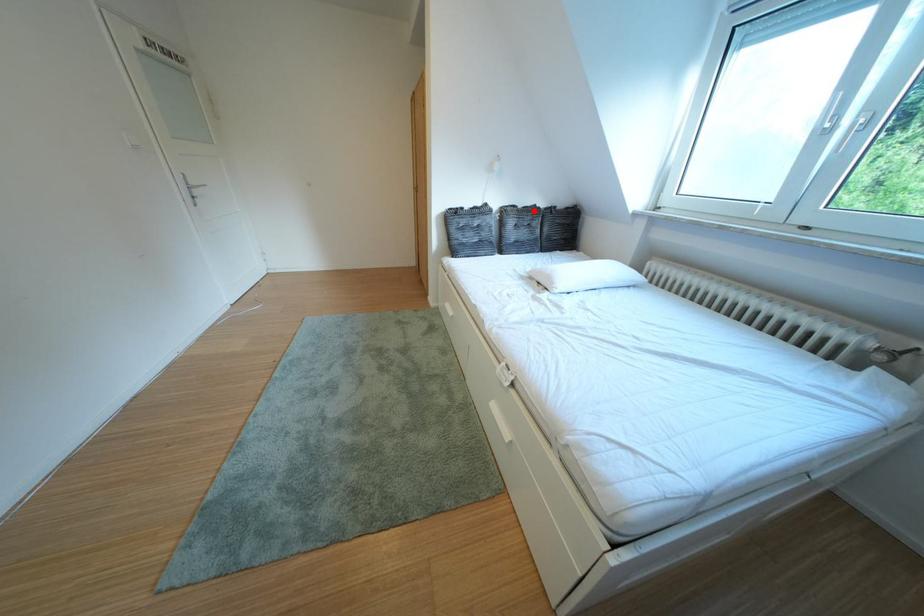
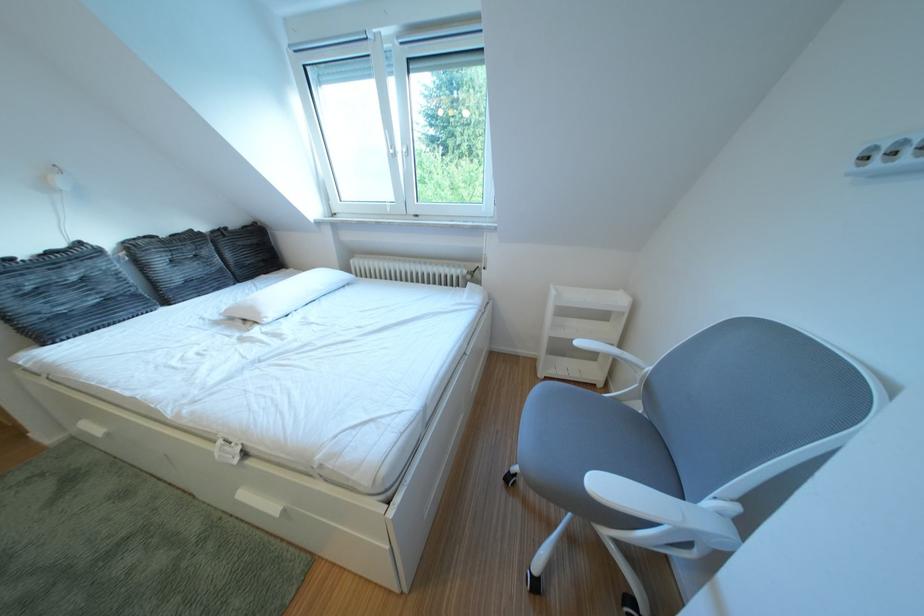
Question: A red point is marked in image1. In image2, is the corresponding 3D point closer to the camera or farther? Reply with the corresponding letter.

Choices:
 (A) The corresponding 3D point is closer.
 (B) The corresponding 3D point is farther.

Answer: (B)